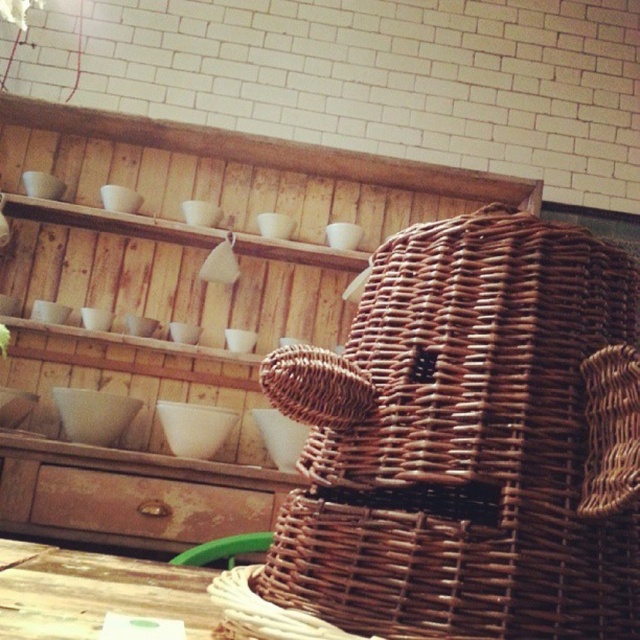
You are a customer in the cafe and want to place your coffee mug on a surface. You see the wooden table at lower left and the rusty wood drawer at lower left. Which surface is more suitable for placing the mug?

The wooden table at lower left is more suitable for placing the mug because it is positioned over the rusty wood drawer at lower left, indicating it is a flat surface designed for placing items.

You are standing in the rustic interior and want to place a small decoration between the two points, point (x=67, y=632) and point (x=240, y=518). Which point should the decoration be closer to so it appears centered between them?

To center the decoration between point (x=67, y=632) and point (x=240, y=518), it should be placed equidistant from both points. Since point (x=67, y=632) is in front of point (x=240, y=518), the decoration should be positioned halfway between them along the line connecting both points.

You are standing in the rustic interior and want to place a small decorative item between the two points, point [384,362] and point [54,600]. Which point should the item be closer to in order to be placed in front of the other point?

The small decorative item should be placed closer to point [384,362] because it is in front of point [54,600].